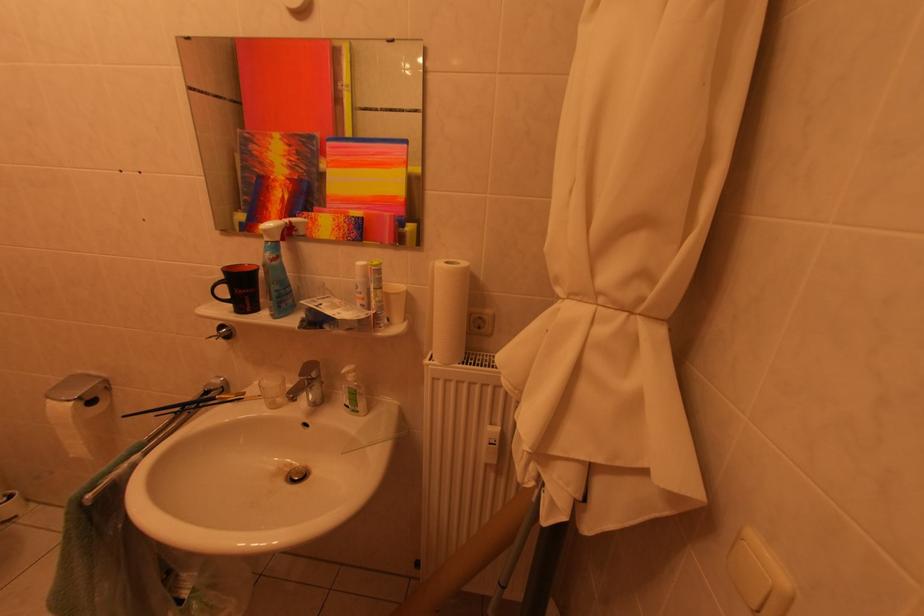
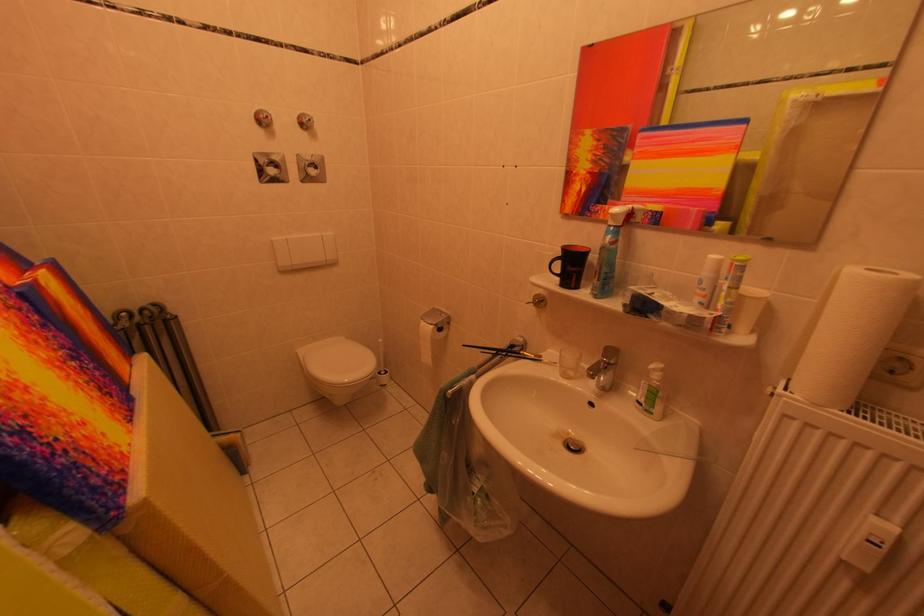
Locate, in the second image, the point that corresponds to the point at 284,298 in the first image.

(613, 280)